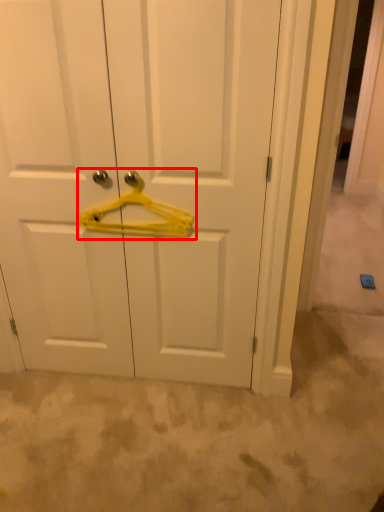
Question: In this image, where is hanger (annotated by the red box) located relative to door?

Choices:
 (A) right
 (B) left

Answer: (A)